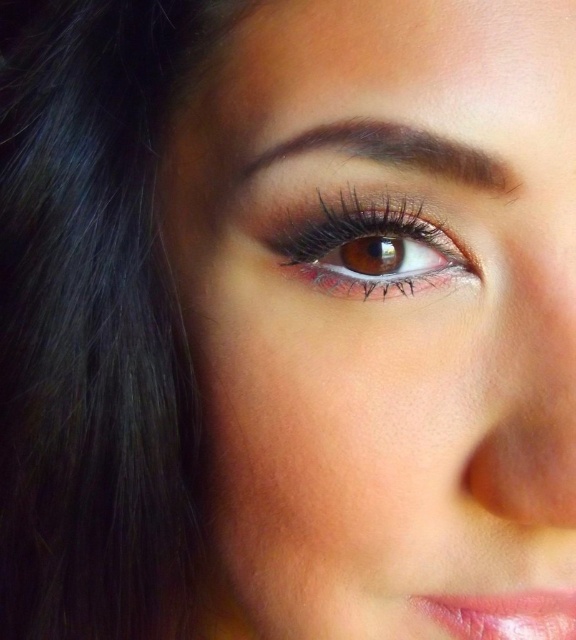
Question: Which point appears farthest from the camera in this image?

Choices:
 (A) (537, 611)
 (B) (422, 150)

Answer: (A)

Question: Considering the relative positions of brown matte eye at center and dark brown matte eyebrow at upper center in the image provided, where is brown matte eye at center located with respect to dark brown matte eyebrow at upper center?

Choices:
 (A) above
 (B) below

Answer: (B)

Question: Can you confirm if matte brown eye at center is smaller than shiny pink lipstick at lower right?

Choices:
 (A) yes
 (B) no

Answer: (B)

Question: Is brown matte eye at center positioned behind shiny pink lipstick at lower right?

Choices:
 (A) no
 (B) yes

Answer: (A)

Question: Considering the real-world distances, which object is farthest from the brown matte eye at center?

Choices:
 (A) dark brown matte eyebrow at upper center
 (B) shiny pink lipstick at lower right
 (C) matte brown eye at center

Answer: (B)

Question: Which point is closer to the camera?

Choices:
 (A) brown matte eye at center
 (B) shiny pink lipstick at lower right

Answer: (A)